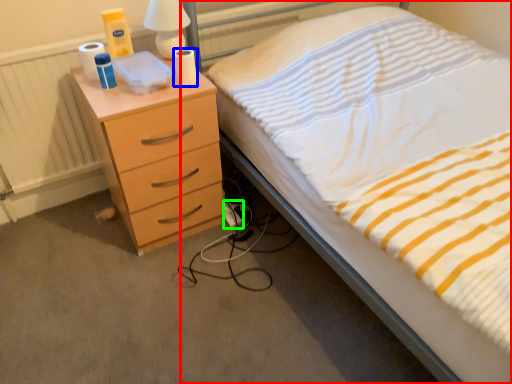
Question: Based on their relative distances, which object is nearer to bed (highlighted by a red box)? Choose from toilet paper (highlighted by a blue box) and extension cord (highlighted by a green box).

Choices:
 (A) toilet paper
 (B) extension cord

Answer: (A)